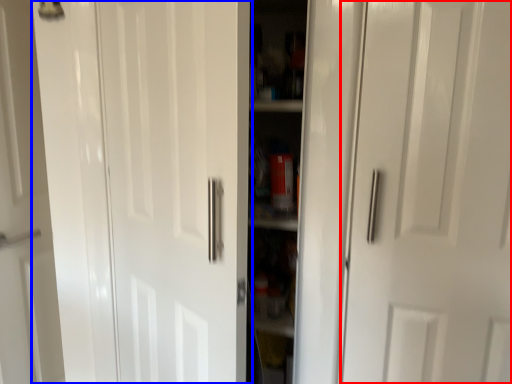
Question: Which object appears closest to the camera in this image, door (highlighted by a red box) or door (highlighted by a blue box)?

Choices:
 (A) door
 (B) door

Answer: (B)